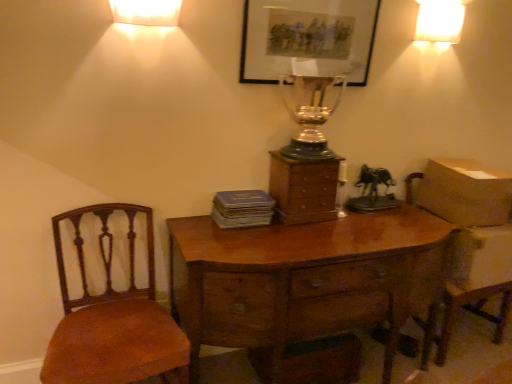
Question: Is white glossy lampshade at upper right, marked as the first lamp in a top-to-bottom arrangement, to the left of wooden armchair at right from the viewer's perspective?

Choices:
 (A) no
 (B) yes

Answer: (B)

Question: Would you consider white glossy lampshade at upper right, marked as the first lamp in a top-to-bottom arrangement, to be distant from wooden armchair at right?

Choices:
 (A) yes
 (B) no

Answer: (A)

Question: Can you confirm if white glossy lampshade at upper right, arranged as the 1th lamp when viewed from the right, is taller than wooden armchair at right?

Choices:
 (A) no
 (B) yes

Answer: (A)

Question: From the image's perspective, is white glossy lampshade at upper right, arranged as the 1th lamp when viewed from the right, under wooden armchair at right?

Choices:
 (A) yes
 (B) no

Answer: (B)

Question: Is white glossy lampshade at upper right, acting as the 2th lamp starting from the bottom, aimed at wooden armchair at right?

Choices:
 (A) yes
 (B) no

Answer: (B)

Question: From a real-world perspective, relative to wooden chest of drawers at center, is white frosted glass lampshade at upper center, positioned as the 1th lamp in bottom-to-top order, vertically above or below?

Choices:
 (A) below
 (B) above

Answer: (B)

Question: Considering the positions of white frosted glass lampshade at upper center, the 1th lamp positioned from the front, and wooden chest of drawers at center in the image, is white frosted glass lampshade at upper center, the 1th lamp positioned from the front, bigger or smaller than wooden chest of drawers at center?

Choices:
 (A) big
 (B) small

Answer: (B)

Question: Considering the relative positions of white frosted glass lampshade at upper center, the second lamp viewed from the right, and wooden chest of drawers at center in the image provided, is white frosted glass lampshade at upper center, the second lamp viewed from the right, to the left or to the right of wooden chest of drawers at center?

Choices:
 (A) right
 (B) left

Answer: (B)

Question: Relative to wooden chest of drawers at center, is white frosted glass lampshade at upper center, the first lamp viewed from the left, in front or behind?

Choices:
 (A) behind
 (B) front

Answer: (B)

Question: Is matte gray book at center situated inside wooden armchair at right or outside?

Choices:
 (A) outside
 (B) inside

Answer: (A)

Question: Is matte gray book at center wider or thinner than wooden armchair at right?

Choices:
 (A) wide
 (B) thin

Answer: (B)

Question: From the image's perspective, is matte gray book at center above or below wooden armchair at right?

Choices:
 (A) above
 (B) below

Answer: (A)

Question: From a real-world perspective, is matte gray book at center physically located above or below wooden armchair at right?

Choices:
 (A) below
 (B) above

Answer: (B)

Question: Looking at the image, does white glossy lampshade at upper right, the 2th lamp viewed from the left, seem bigger or smaller compared to white frosted glass lampshade at upper center, the 1th lamp positioned from the front?

Choices:
 (A) big
 (B) small

Answer: (A)

Question: In the image, is white glossy lampshade at upper right, the 2th lamp viewed from the left, positioned in front of or behind white frosted glass lampshade at upper center, positioned as the 1th lamp in bottom-to-top order?

Choices:
 (A) behind
 (B) front

Answer: (A)